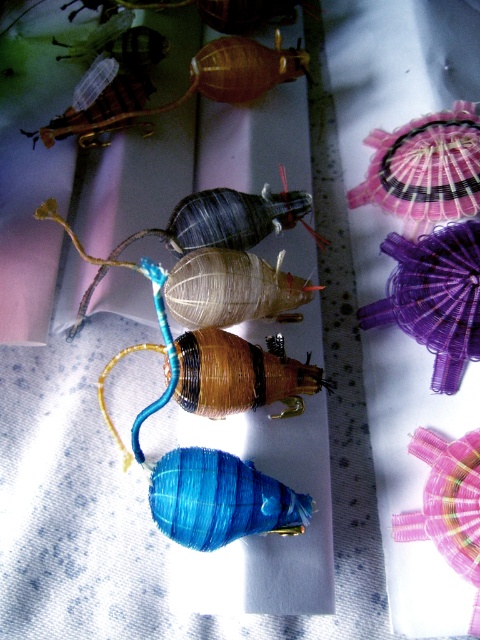
Who is more distant from viewer, (x=123, y=241) or (x=211, y=81)?

The point (x=211, y=81) is behind.

Is matte blue spool at center positioned before translucent amber shell at upper center?

That is True.

Is point (184, 256) farther from camera compared to point (251, 45)?

No.

The width and height of the screenshot is (480, 640). Find the location of `matte blue spool at center`. matte blue spool at center is located at coordinates (204, 227).